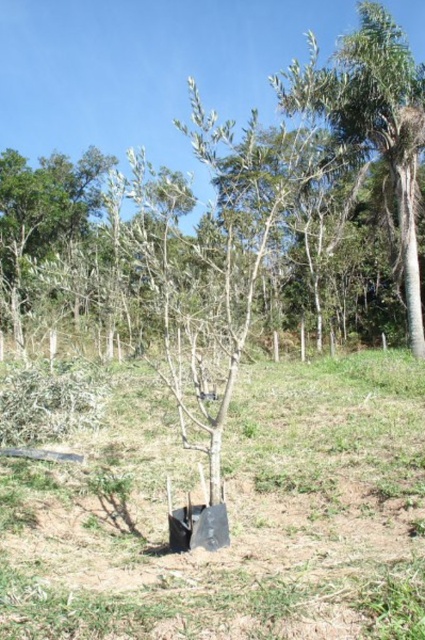
Question: Can you confirm if green grass at center is smaller than green leafy tree at upper center?

Choices:
 (A) no
 (B) yes

Answer: (B)

Question: Is green grass at center to the right of green leafy tree at upper center from the viewer's perspective?

Choices:
 (A) no
 (B) yes

Answer: (A)

Question: Can you confirm if green grass at center is bigger than green leafy tree at upper center?

Choices:
 (A) no
 (B) yes

Answer: (A)